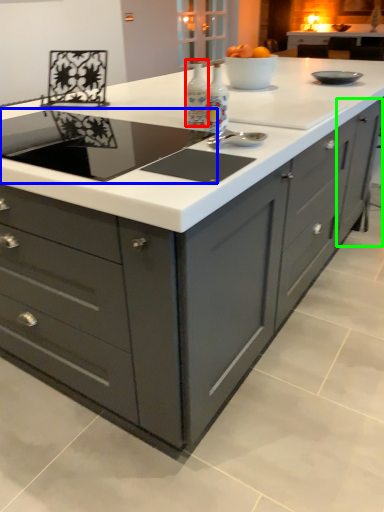
Question: Estimate the real-world distances between objects in this image. Which object is closer to appliance (highlighted by a red box), home appliance (highlighted by a blue box) or cabinetry (highlighted by a green box)?

Choices:
 (A) home appliance
 (B) cabinetry

Answer: (A)